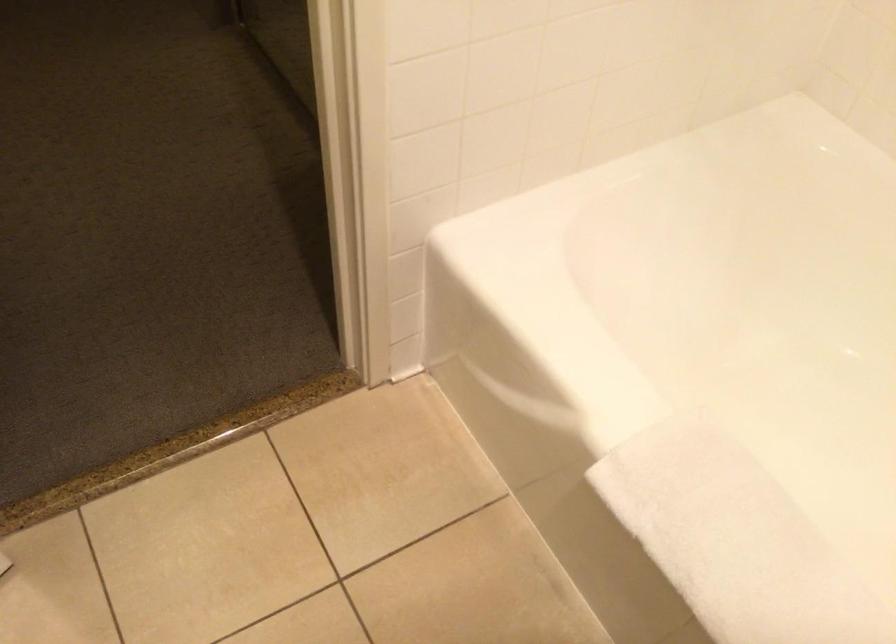
This screenshot has height=644, width=896. What do you see at coordinates (736, 541) in the screenshot?
I see `the white bath mat` at bounding box center [736, 541].